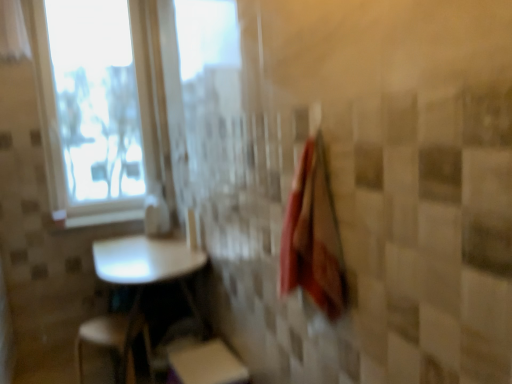
The height and width of the screenshot is (384, 512). Describe the element at coordinates (313, 235) in the screenshot. I see `red cotton bath towel at right` at that location.

This screenshot has width=512, height=384. Identify the location of white matte step stool at lower center, placed as the 1th step stool when sorted from right to left. (207, 364).

Locate an element on the screen. The height and width of the screenshot is (384, 512). transparent plastic window screen at upper left is located at coordinates (96, 99).

The width and height of the screenshot is (512, 384). Identify the location of red cotton bath towel at right. (313, 235).

Is white glossy table at lower left inside the boundaries of white sheer curtain at upper left, or outside?

white glossy table at lower left cannot be found inside white sheer curtain at upper left.

Where is `table located in front of the white sheer curtain at upper left`? table located in front of the white sheer curtain at upper left is located at coordinates (144, 260).

Considering the sizes of white glossy table at lower left and white sheer curtain at upper left in the image, is white glossy table at lower left wider or thinner than white sheer curtain at upper left?

In the image, white glossy table at lower left appears to be wider than white sheer curtain at upper left.

From a real-world perspective, is white plastic step stool at lower left, which is the 2th step stool in right-to-left order, physically located above or below transparent plastic window screen at upper left?

white plastic step stool at lower left, which is the 2th step stool in right-to-left order, is situated lower than transparent plastic window screen at upper left in the real world.

Is white plastic step stool at lower left, placed as the 1th step stool when sorted from left to right, further to camera compared to transparent plastic window screen at upper left?

No, white plastic step stool at lower left, placed as the 1th step stool when sorted from left to right, is closer to the viewer.

Is white plastic step stool at lower left, which is the 2th step stool in right-to-left order, turned away from transparent plastic window screen at upper left?

white plastic step stool at lower left, which is the 2th step stool in right-to-left order, does not have its back to transparent plastic window screen at upper left.

Can transparent plastic window screen at upper left be found inside white plastic step stool at lower left, placed as the 1th step stool when sorted from left to right?

No, white plastic step stool at lower left, placed as the 1th step stool when sorted from left to right, does not contain transparent plastic window screen at upper left.

Find the location of a particular element. The image size is (512, 384). table that appears behind the white matte step stool at lower center, placed as the 1th step stool when sorted from right to left is located at coordinates (144, 260).

Is white glossy table at lower left beside white matte step stool at lower center, placed as the 2th step stool when sorted from left to right?

white glossy table at lower left and white matte step stool at lower center, placed as the 2th step stool when sorted from left to right, are clearly separated.

Between white glossy table at lower left and white matte step stool at lower center, placed as the 1th step stool when sorted from right to left, which one has less height?

Standing shorter between the two is white matte step stool at lower center, placed as the 1th step stool when sorted from right to left.

Who is bigger, white glossy table at lower left or white matte step stool at lower center, placed as the 2th step stool when sorted from left to right?

With larger size is white glossy table at lower left.

I want to click on table that appears in front of the white plastic step stool at lower left, placed as the 1th step stool when sorted from left to right, so (x=144, y=260).

From the image's perspective, is white plastic step stool at lower left, which is the 2th step stool in right-to-left order, above or below white glossy table at lower left?

white plastic step stool at lower left, which is the 2th step stool in right-to-left order, is below white glossy table at lower left.

Is white glossy table at lower left inside white plastic step stool at lower left, placed as the 1th step stool when sorted from left to right?

That's incorrect, white glossy table at lower left is not inside white plastic step stool at lower left, placed as the 1th step stool when sorted from left to right.

How distant is white plastic step stool at lower left, which is the 2th step stool in right-to-left order, from white glossy table at lower left?

A distance of 38.76 centimeters exists between white plastic step stool at lower left, which is the 2th step stool in right-to-left order, and white glossy table at lower left.

Does white glossy window sill at upper left touch white sheer curtain at upper left?

No, white glossy window sill at upper left is not beside white sheer curtain at upper left.

Based on the photo, considering the sizes of objects white glossy window sill at upper left and white sheer curtain at upper left in the image provided, who is thinner, white glossy window sill at upper left or white sheer curtain at upper left?

white sheer curtain at upper left is thinner.

You are a GUI agent. You are given a task and a screenshot of the screen. Output one action in this format:
    pyautogui.click(x=<x>, y=<y>)
    Task: Click on the curtain above the white glossy window sill at upper left (from the image's perspective)
    This screenshot has height=384, width=512.
    Given the screenshot: What is the action you would take?
    pyautogui.click(x=13, y=32)

From the image's perspective, relative to white sheer curtain at upper left, is white glossy window sill at upper left above or below?

Clearly, from the image's perspective, white glossy window sill at upper left is below white sheer curtain at upper left.

Between red cotton bath towel at right and white glossy window sill at upper left, which one has smaller width?

red cotton bath towel at right is thinner.

Which point is more distant from viewer, (305, 236) or (102, 215)?

Positioned behind is point (102, 215).

From a real-world perspective, which object stands above the other?

red cotton bath towel at right.

Is red cotton bath towel at right oriented towards white glossy window sill at upper left?

No, red cotton bath towel at right is not oriented towards white glossy window sill at upper left.

Between point (121, 263) and point (89, 186), which one is positioned in front?

Point (121, 263)

Would you say white glossy table at lower left is a long distance from transparent plastic window screen at upper left?

Indeed, white glossy table at lower left is not near transparent plastic window screen at upper left.

Is white glossy table at lower left positioned beyond the bounds of transparent plastic window screen at upper left?

white glossy table at lower left is positioned outside transparent plastic window screen at upper left.

Does white glossy table at lower left have a smaller size compared to transparent plastic window screen at upper left?

No.

The height and width of the screenshot is (384, 512). Identify the location of curtain on the left of white glossy table at lower left. (13, 32).

There is a white plastic step stool at lower left, which is the 2th step stool in right-to-left order. Identify the location of window screen above it (from a real-world perspective). (96, 99).

Estimate the real-world distances between objects in this image. Which object is closer to white matte step stool at lower center, placed as the 1th step stool when sorted from right to left, white glossy table at lower left or red cotton bath towel at right?

white glossy table at lower left is closer to white matte step stool at lower center, placed as the 1th step stool when sorted from right to left.

Estimate the real-world distances between objects in this image. Which object is further from white sheer curtain at upper left, transparent plastic window screen at upper left or white matte step stool at lower center, placed as the 1th step stool when sorted from right to left?

white matte step stool at lower center, placed as the 1th step stool when sorted from right to left, lies further to white sheer curtain at upper left than the other object.

Considering their positions, is white sheer curtain at upper left positioned closer to white matte step stool at lower center, placed as the 2th step stool when sorted from left to right, than white glossy table at lower left?

white glossy table at lower left is positioned closer to the anchor white matte step stool at lower center, placed as the 2th step stool when sorted from left to right.

Which object lies further to the anchor point red cotton bath towel at right, white plastic step stool at lower left, which is the 2th step stool in right-to-left order, or white matte step stool at lower center, placed as the 2th step stool when sorted from left to right?

white plastic step stool at lower left, which is the 2th step stool in right-to-left order, is further to red cotton bath towel at right.

When comparing their distances from red cotton bath towel at right, does transparent plastic window screen at upper left or white matte step stool at lower center, placed as the 2th step stool when sorted from left to right, seem further?

transparent plastic window screen at upper left is positioned further to the anchor red cotton bath towel at right.

When comparing their distances from white plastic step stool at lower left, placed as the 1th step stool when sorted from left to right, does red cotton bath towel at right or white sheer curtain at upper left seem closer?

red cotton bath towel at right is closer to white plastic step stool at lower left, placed as the 1th step stool when sorted from left to right.

Considering their positions, is red cotton bath towel at right positioned further to transparent plastic window screen at upper left than white plastic step stool at lower left, placed as the 1th step stool when sorted from left to right?

Based on the image, red cotton bath towel at right appears to be further to transparent plastic window screen at upper left.

Based on their spatial positions, is transparent plastic window screen at upper left or white matte step stool at lower center, placed as the 2th step stool when sorted from left to right, further from white glossy table at lower left?

transparent plastic window screen at upper left is positioned further to the anchor white glossy table at lower left.

Locate an element on the screen. The image size is (512, 384). table between white sheer curtain at upper left and white plastic step stool at lower left, placed as the 1th step stool when sorted from left to right, from top to bottom is located at coordinates (144, 260).

The width and height of the screenshot is (512, 384). What are the coordinates of `step stool located between red cotton bath towel at right and white plastic step stool at lower left, which is the 2th step stool in right-to-left order, in the depth direction` in the screenshot? It's located at (207, 364).

Image resolution: width=512 pixels, height=384 pixels. What are the coordinates of `step stool positioned between white matte step stool at lower center, placed as the 2th step stool when sorted from left to right, and white glossy window sill at upper left from near to far` in the screenshot? It's located at (100, 336).

Where is `window screen that lies between white sheer curtain at upper left and white plastic step stool at lower left, placed as the 1th step stool when sorted from left to right, from top to bottom`? This screenshot has height=384, width=512. window screen that lies between white sheer curtain at upper left and white plastic step stool at lower left, placed as the 1th step stool when sorted from left to right, from top to bottom is located at coordinates (96, 99).